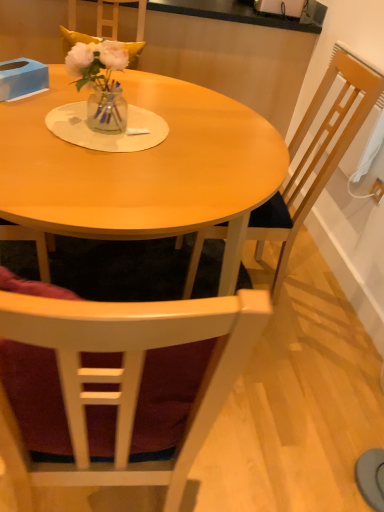
Question: From a real-world perspective, is matte wood table at center positioned above or below translucent glass vase at center?

Choices:
 (A) above
 (B) below

Answer: (B)

Question: Is point (233, 271) positioned closer to the camera than point (99, 44)?

Choices:
 (A) closer
 (B) farther

Answer: (B)

Question: Based on their relative distances, which object is nearer to the wooden chair at right, positioned as the 1th chair in top-to-bottom order?

Choices:
 (A) white plastic power outlet at upper right
 (B) translucent glass vase at center
 (C) matte wood table at center
 (D) blue cardboard box at upper left
 (E) wooden chair at center, which is the first chair in bottom-to-top order

Answer: (C)

Question: Based on their relative distances, which object is nearer to the wooden chair at right, the second chair when ordered from bottom to top?

Choices:
 (A) translucent glass vase at center
 (B) blue cardboard box at upper left
 (C) white plastic power outlet at upper right
 (D) matte wood table at center
 (E) wooden chair at center, the 2th chair positioned from the top

Answer: (D)